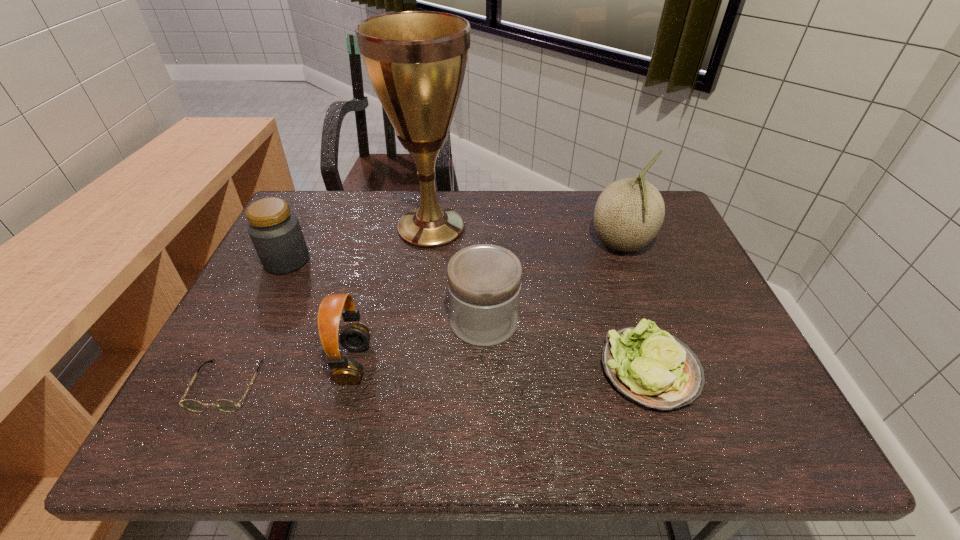
Locate an element on the screen. Image resolution: width=960 pixels, height=540 pixels. vacant space located 0.240m on the surface of the farther jar near the warning symbol is located at coordinates [x=397, y=261].

The height and width of the screenshot is (540, 960). Identify the location of vacant region located on the left of the right jar. (420, 321).

Image resolution: width=960 pixels, height=540 pixels. Find the location of `vacant space located 0.360m on the left of the lettuce`. vacant space located 0.360m on the left of the lettuce is located at coordinates (433, 370).

Identify the location of vacant space located 0.050m on the lenses of the spectacles. The width and height of the screenshot is (960, 540). (202, 438).

Identify the location of trophy cup that is at the far edge. Image resolution: width=960 pixels, height=540 pixels. (416, 61).

Locate an element on the screen. This screenshot has width=960, height=540. cantaloup that is at the far edge is located at coordinates (629, 213).

Find the location of a particular element. The height and width of the screenshot is (540, 960). lettuce present at the near edge is located at coordinates (649, 366).

Find the location of a particular element. spectacles present at the near edge is located at coordinates (225, 405).

What are the coordinates of `jar at the left edge` in the screenshot? It's located at pyautogui.click(x=276, y=234).

Image resolution: width=960 pixels, height=540 pixels. What are the coordinates of `spectacles that is at the left edge` in the screenshot? It's located at (225, 405).